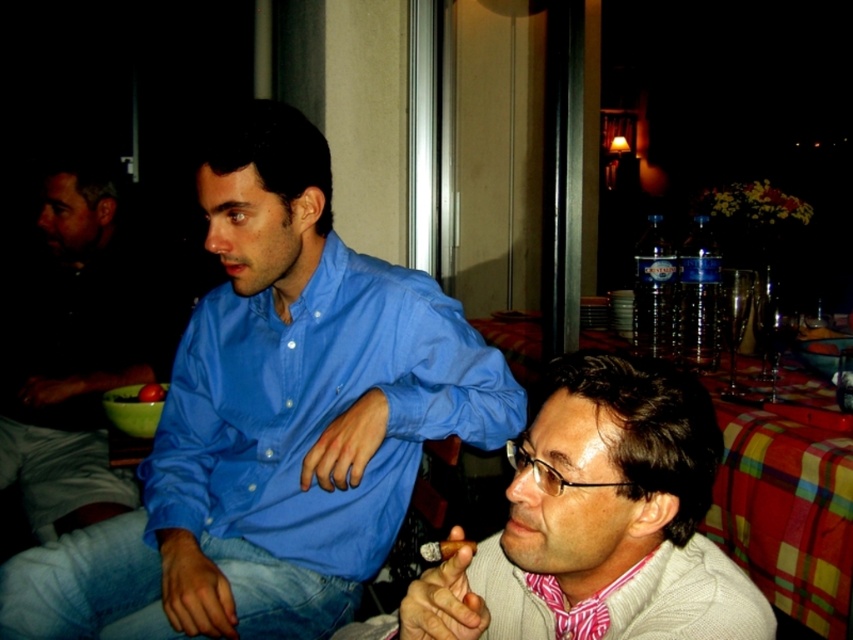
Question: Which is farther from the plaid fabric tablecloth at lower right?

Choices:
 (A) blue cotton shirt at center
 (B) blue smooth shirt at center
 (C) dark blue shirt at left

Answer: (C)

Question: Is blue smooth shirt at center further to camera compared to smooth tomato at center?

Choices:
 (A) no
 (B) yes

Answer: (A)

Question: Which of the following is the farthest from the observer?

Choices:
 (A) (3, 452)
 (B) (138, 401)
 (C) (379, 524)
 (D) (824, 380)

Answer: (A)

Question: Is plaid fabric tablecloth at lower right behind smooth tomato at center?

Choices:
 (A) no
 (B) yes

Answer: (A)

Question: In this image, where is blue cotton shirt at center located relative to plaid fabric tablecloth at lower right?

Choices:
 (A) right
 (B) left

Answer: (B)

Question: Estimate the real-world distances between objects in this image. Which object is farther from the smooth tomato at center?

Choices:
 (A) blue smooth shirt at center
 (B) plaid fabric tablecloth at lower right
 (C) dark blue shirt at left
 (D) blue cotton shirt at center

Answer: (B)